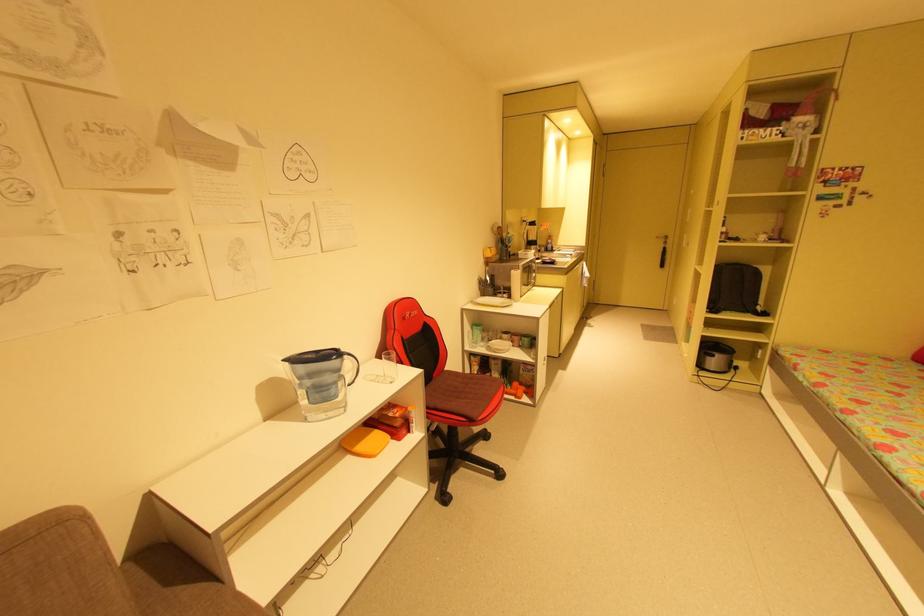
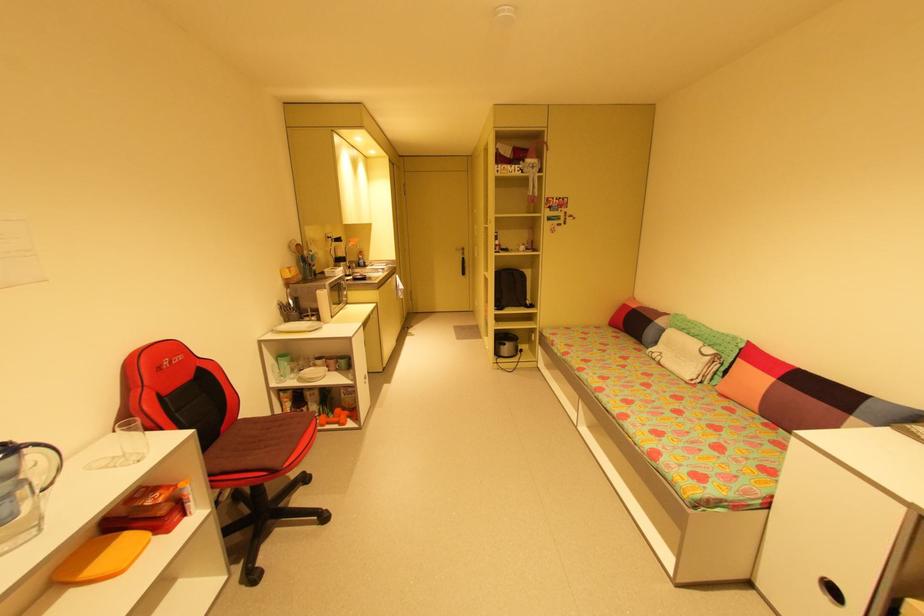
In the second image, find the point that corresponds to point 771,270 in the first image.

(532, 273)